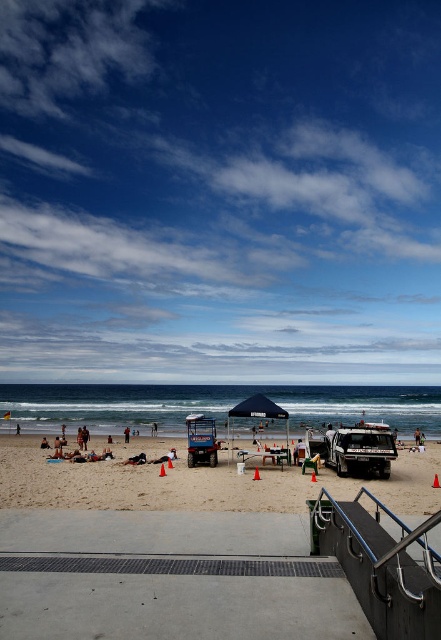
Measure the distance between point (351,582) and camera.

Point (351,582) and camera are 5.09 meters apart.

Does polished metal handrail at lower right appear on the right side of metallic blue jeep at center?

Correct, you'll find polished metal handrail at lower right to the right of metallic blue jeep at center.

Is point (370, 582) in front of point (197, 432)?

Yes, it is in front of point (197, 432).

Locate an element on the screen. polished metal handrail at lower right is located at coordinates [x=381, y=564].

Does metallic blue jeep at center lie behind tan skin person at lower center?

No, metallic blue jeep at center is closer to the viewer.

In the scene shown: Does metallic blue jeep at center appear over tan skin person at lower center?

Yes, metallic blue jeep at center is above tan skin person at lower center.

Is point (195, 454) farther from camera compared to point (415, 442)?

No.

This screenshot has width=441, height=640. I want to click on metallic blue jeep at center, so click(201, 440).

Which is behind, point (96, 355) or point (135, 456)?

The point (96, 355) is behind.

Between point (100, 67) and point (142, 456), which one is positioned in front?

Point (142, 456) is more forward.

Which is in front, point (350, 179) or point (139, 456)?

Point (139, 456) is more forward.

Locate an element on the screen. The height and width of the screenshot is (640, 441). blue sky at upper center is located at coordinates point(220,189).